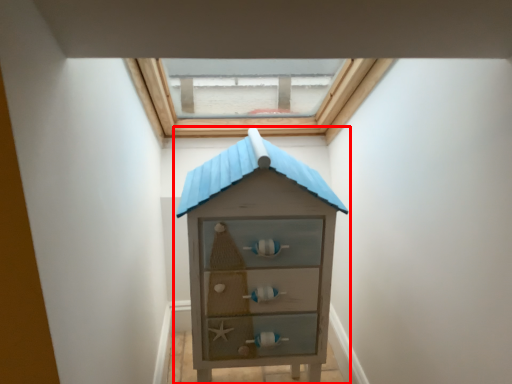
Question: From the image, what is the correct spatial relationship of chest of drawers (annotated by the red box) in relation to window?

Choices:
 (A) left
 (B) right

Answer: (B)